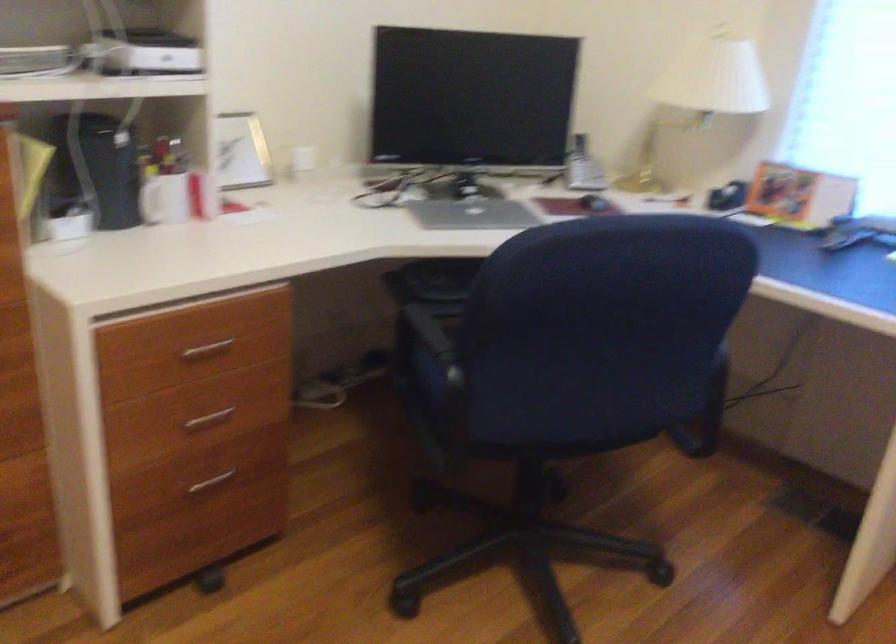
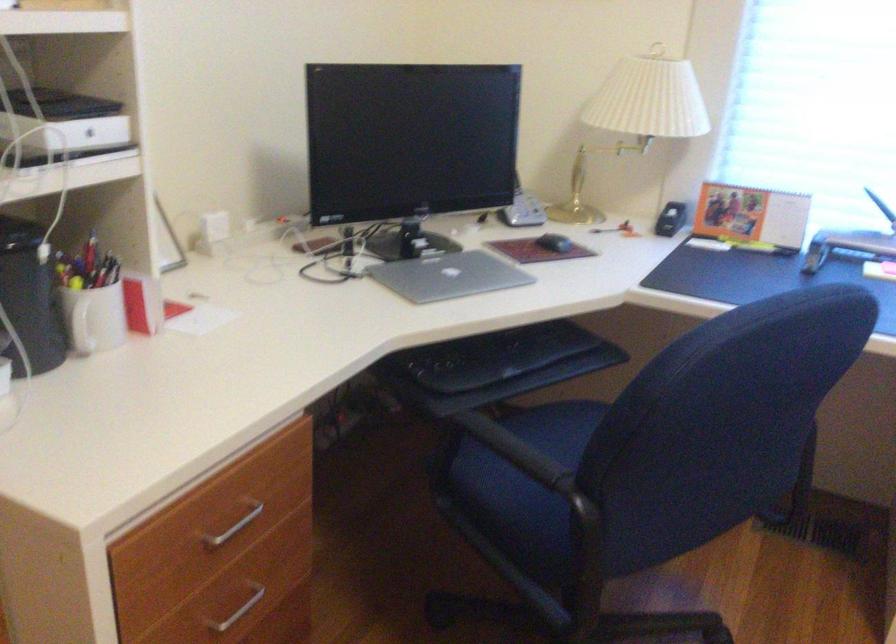
Where in the second image is the point corresponding to pixel 590 200 from the first image?

(554, 243)